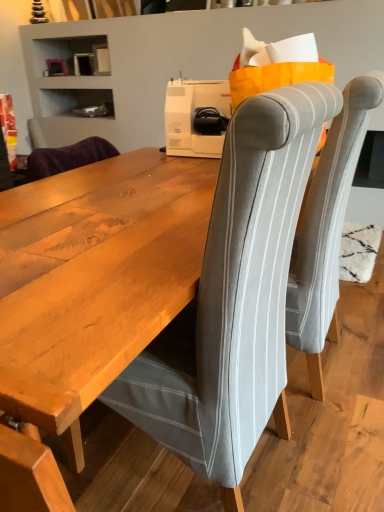
The width and height of the screenshot is (384, 512). Find the location of `vacant area situated below gray striped fabric chair at center (from a real-world perspective)`. vacant area situated below gray striped fabric chair at center (from a real-world perspective) is located at coordinates (181, 471).